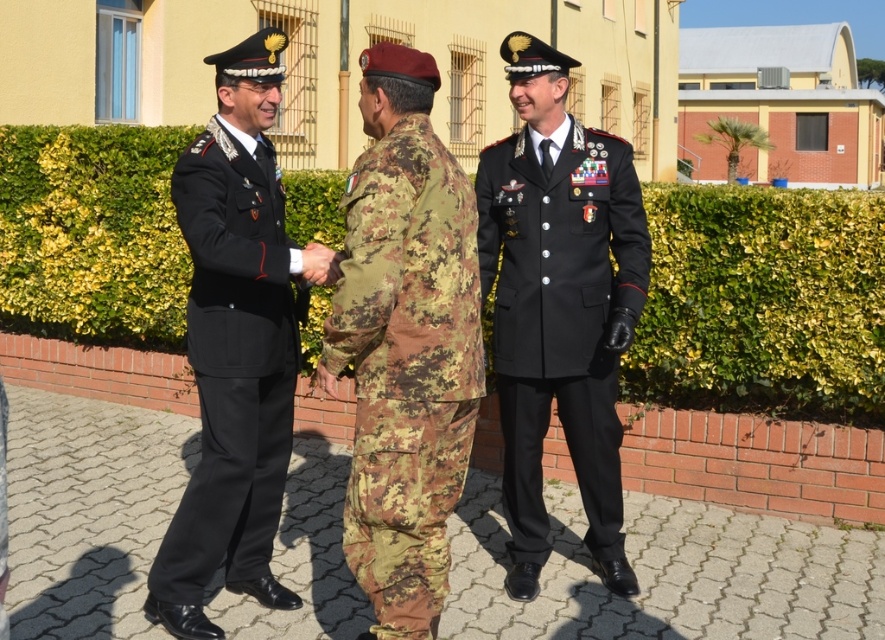
Question: Is the position of green leafy hedge at center less distant than that of black woolen coat at center?

Choices:
 (A) no
 (B) yes

Answer: (A)

Question: Does camouflage fabric uniform at center appear under black woolen coat at center?

Choices:
 (A) yes
 (B) no

Answer: (A)

Question: Which point is farther from the camera taking this photo?

Choices:
 (A) (368, 321)
 (B) (528, 448)
 (C) (12, 278)
 (D) (252, 257)

Answer: (C)

Question: Can you confirm if camouflage fabric uniform at center is thinner than black woolen coat at center?

Choices:
 (A) yes
 (B) no

Answer: (A)

Question: Among these points, which one is farthest from the camera?

Choices:
 (A) (532, 148)
 (B) (799, 211)

Answer: (B)

Question: Which point is closer to the camera taking this photo?

Choices:
 (A) (337, 364)
 (B) (256, 381)
 (C) (41, 284)
 (D) (578, 403)

Answer: (A)